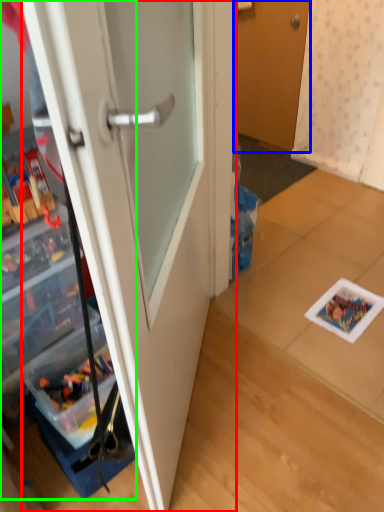
Question: Which object is positioned farthest from door (highlighted by a red box)? Select from door (highlighted by a blue box) and cabinetry (highlighted by a green box).

Choices:
 (A) door
 (B) cabinetry

Answer: (A)